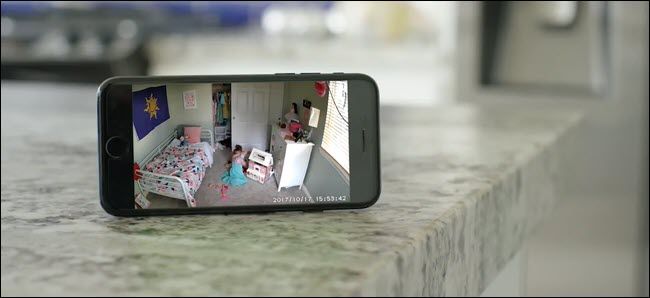
This screenshot has width=650, height=298. What are the coordinates of `pillow` in the screenshot? It's located at (196, 135).